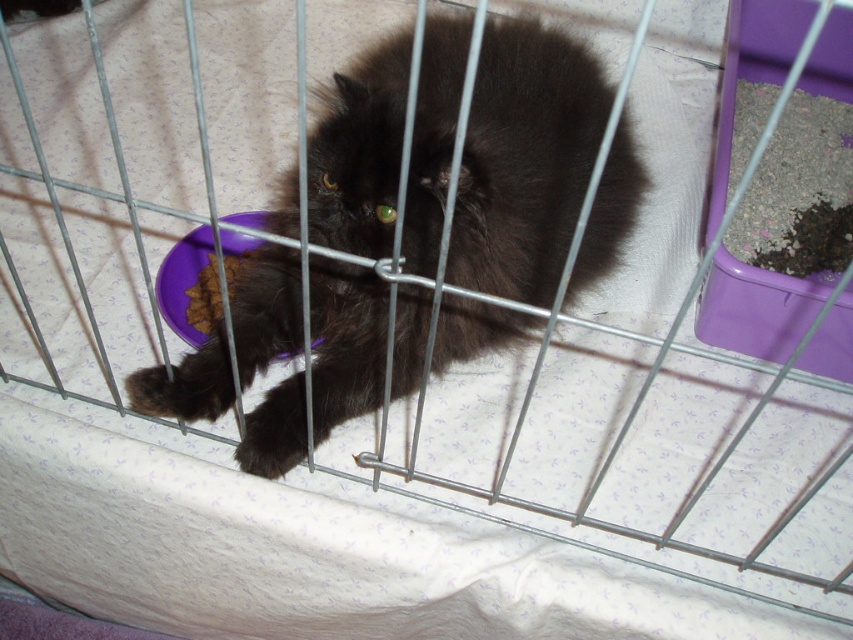
Question: Is fluffy black cat at center to the right of brown crumbly food at lower left from the viewer's perspective?

Choices:
 (A) no
 (B) yes

Answer: (B)

Question: Does fluffy black cat at center appear on the left side of brown crumbly food at lower left?

Choices:
 (A) no
 (B) yes

Answer: (A)

Question: Which point is farther to the camera?

Choices:
 (A) click(x=457, y=52)
 (B) click(x=194, y=326)

Answer: (A)

Question: Does fluffy black cat at center appear over brown crumbly food at lower left?

Choices:
 (A) yes
 (B) no

Answer: (A)